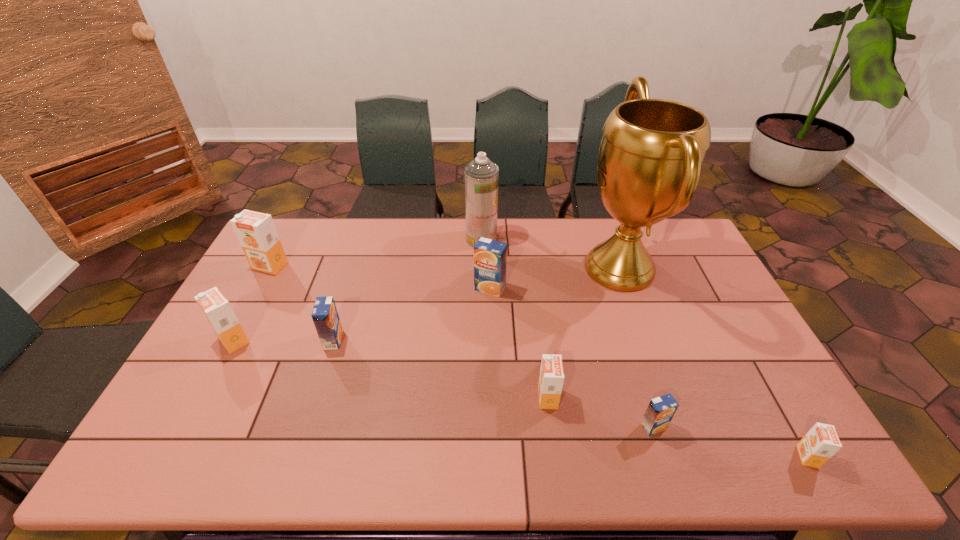
You are a GUI agent. You are given a task and a screenshot of the screen. Output one action in this format:
    pyautogui.click(x=<x>, y=<y>)
    Task: Click on the trophy cup
    
    Given the screenshot: What is the action you would take?
    pyautogui.click(x=652, y=150)

Image resolution: width=960 pixels, height=540 pixels. What are the coordinates of `gold trophy cup` in the screenshot? It's located at (652, 150).

Identify the location of the eighth shortest object. (481, 176).

Find the location of `the farthest orange juice`. the farthest orange juice is located at coordinates (256, 232).

This screenshot has width=960, height=540. Find the location of `the third tallest object`. the third tallest object is located at coordinates (256, 232).

At what (x,y) coordinates should I click in order to perform the action: click on the biggest blue orange_juice. Please return your answer as a coordinate pair (x, y). The width and height of the screenshot is (960, 540). Looking at the image, I should click on pyautogui.click(x=490, y=256).

Find the location of a particular element. the farthest blue orange_juice is located at coordinates (490, 256).

Where is `the second farthest orange orange juice`? This screenshot has width=960, height=540. the second farthest orange orange juice is located at coordinates (216, 308).

Identify the location of the leftmost blue orange_juice. Image resolution: width=960 pixels, height=540 pixels. (325, 316).

Locate an element on the screen. The height and width of the screenshot is (540, 960). the second biggest blue orange_juice is located at coordinates (325, 316).